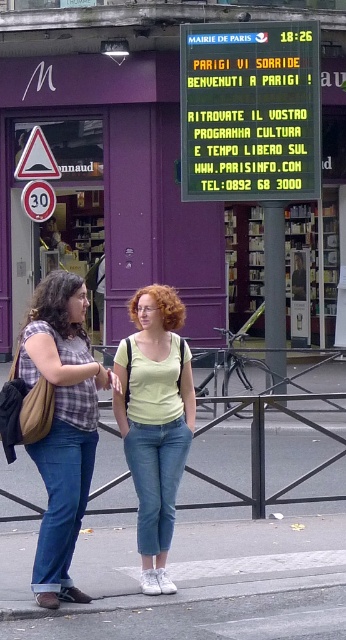
You are a tourist in Paris and you see a light green cotton tank top at center and a red plastic speed limit sign at left. Which object is taller?

The light green cotton tank top at center is taller than the red plastic speed limit sign at left.

You are a tourist in Paris and see the MAIRIE DE PARIS signboard with a blue digital display at upper center. There is also a purple bookstore with a glass door and a 30 kmh speed limit sign. Where is the point at coordinates [250,112] located?

The point at coordinates [250,112] is located on the blue digital display at upper center.

You are standing at the point closer to the bookstore entrance. Which point, point (198, 138) or point (151, 355), is farther away from you?

Point (198, 138) is behind point (151, 355), so if you are standing at the point closer to the bookstore entrance, point (198, 138) is farther away from you.